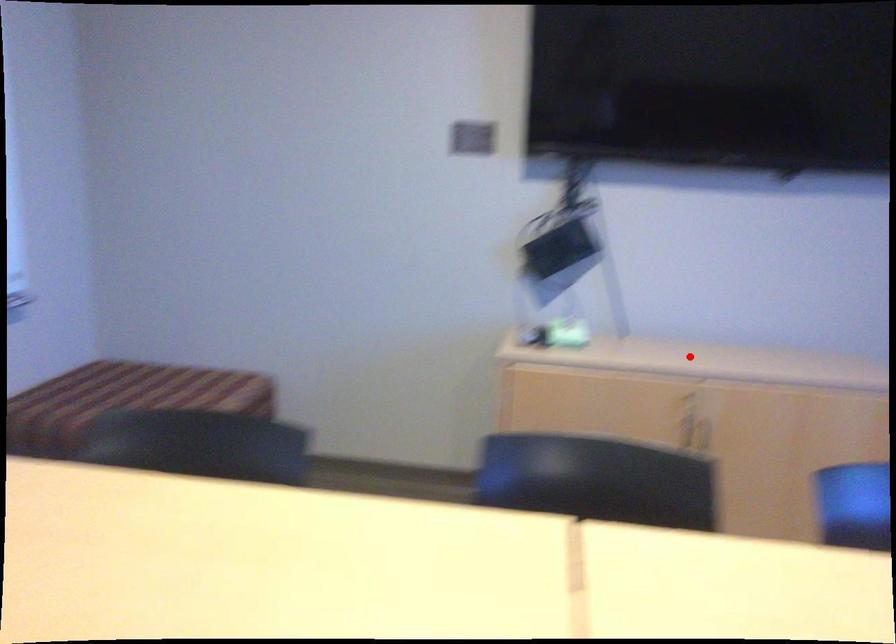
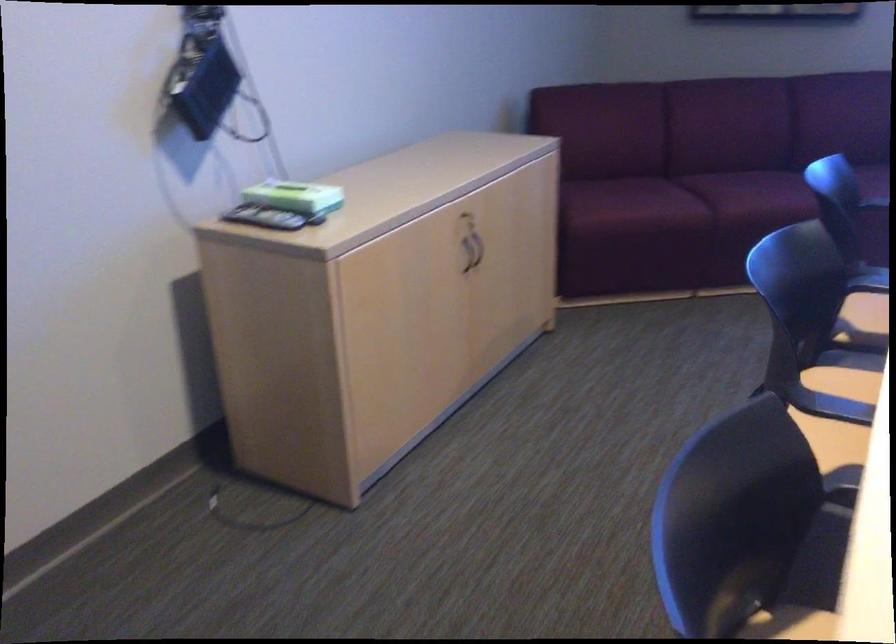
Find the pixel in the second image that matches the highlighted location in the first image.

(428, 175)